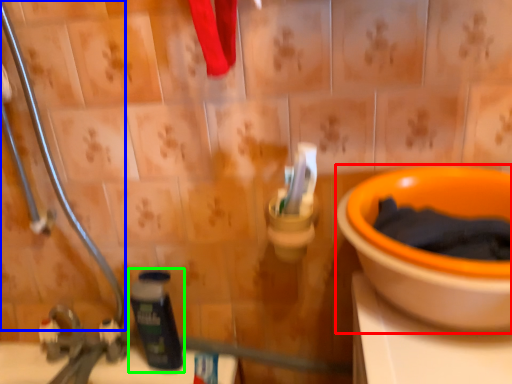
Question: Based on their relative distances, which object is nearer to toilet (highlighted by a red box)? Choose from pipe (highlighted by a blue box) and bottle (highlighted by a green box).

Choices:
 (A) pipe
 (B) bottle

Answer: (B)